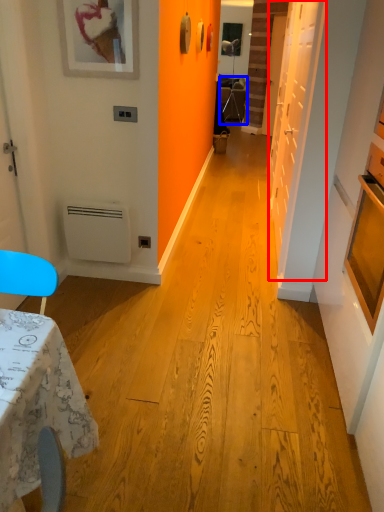
Question: Among these objects, which one is farthest to the camera, door (highlighted by a red box) or armchair (highlighted by a blue box)?

Choices:
 (A) door
 (B) armchair

Answer: (B)